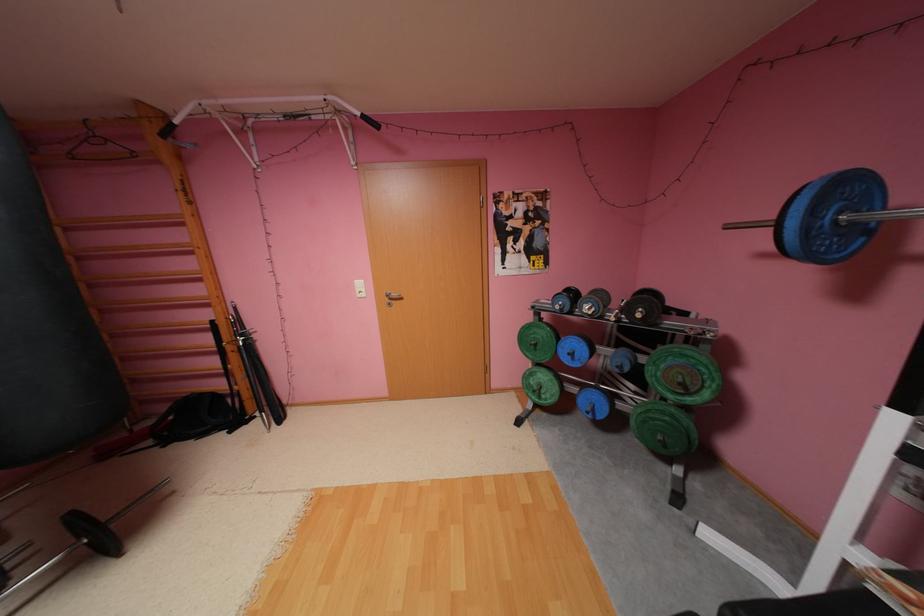
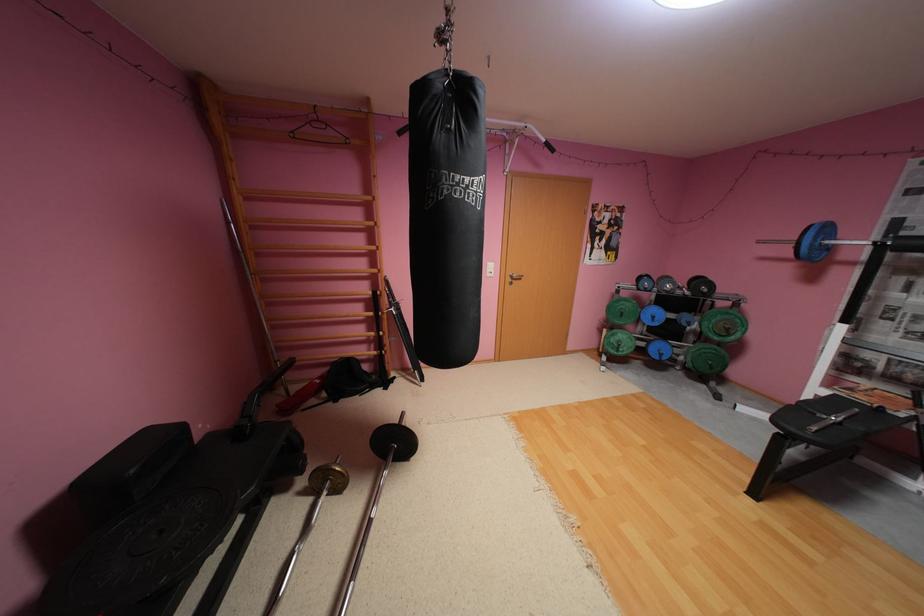
Question: In a continuous first-person perspective shot, in which direction is the camera moving?

Choices:
 (A) Left
 (B) Right
 (C) Forward
 (D) Backward

Answer: (A)